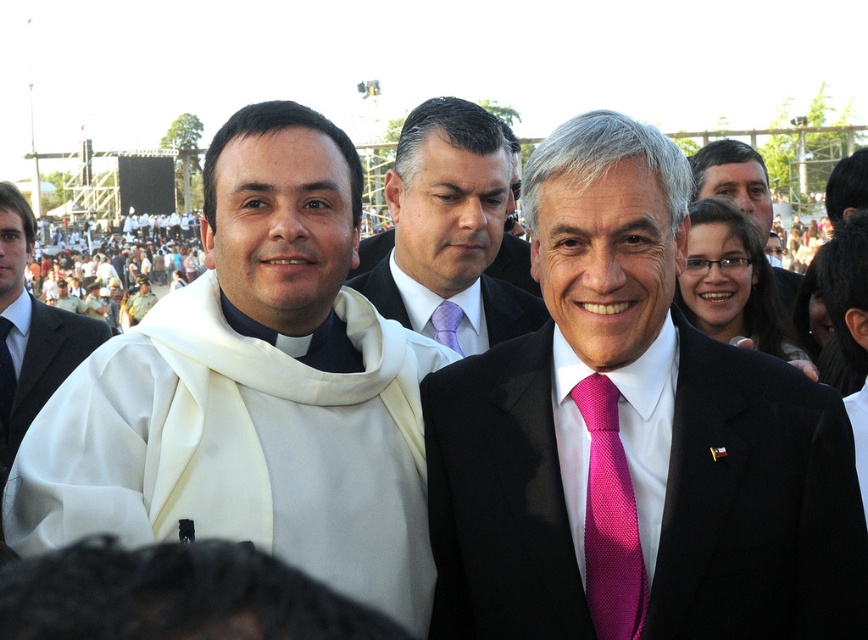
Describe the element at coordinates (253, 388) in the screenshot. I see `white cloth at left` at that location.

Between point (206, 180) and point (444, 328), which one is positioned behind?

Point (444, 328)

Identify the location of white cloth at left. (253, 388).

Locate an element on the screen. white cloth at left is located at coordinates (253, 388).

Between purple satin tie at center and purple satin suit at center, which one has more height?

purple satin tie at center

Between purple satin tie at center and purple satin suit at center, which one is positioned lower?

purple satin suit at center

Is point (434, 147) behind point (365, 273)?

No, (434, 147) is closer to viewer.

You are a GUI agent. You are given a task and a screenshot of the screen. Output one action in this format:
    pyautogui.click(x=<x>, y=<y>)
    Task: Click on the purple satin tie at center
    The height and width of the screenshot is (640, 868).
    Given the screenshot: What is the action you would take?
    pyautogui.click(x=449, y=225)

Is white cloth at left wider than white cloth crowd at upper left?

Incorrect, white cloth at left's width does not surpass white cloth crowd at upper left's.

Who is positioned more to the left, white cloth at left or white cloth crowd at upper left?

white cloth crowd at upper left

Where is `white cloth at left`? white cloth at left is located at coordinates (253, 388).

Where is `white cloth at left`? This screenshot has width=868, height=640. white cloth at left is located at coordinates (253, 388).